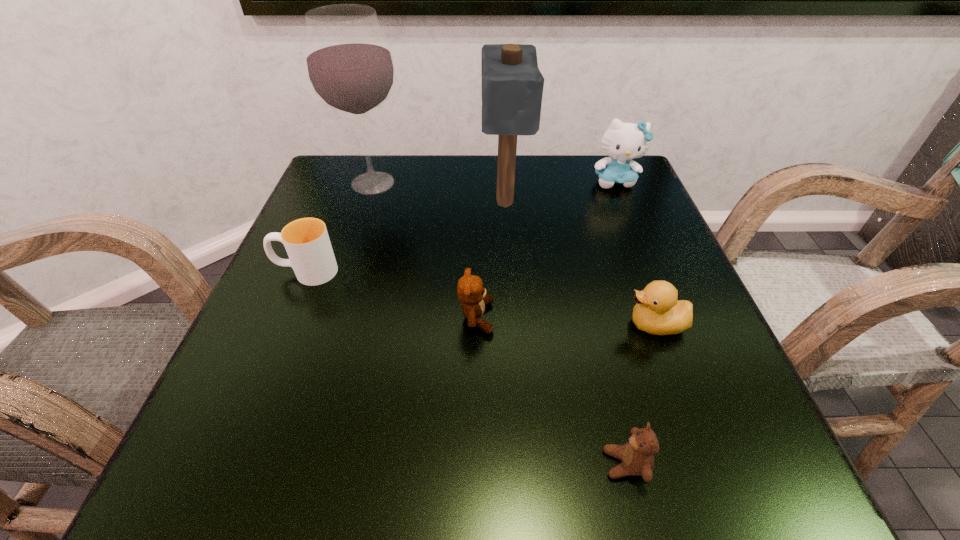
Where is `vacant position located on the face of the fifth shortest object`? The width and height of the screenshot is (960, 540). vacant position located on the face of the fifth shortest object is located at coordinates point(633,224).

You are a GUI agent. You are given a task and a screenshot of the screen. Output one action in this format:
    pyautogui.click(x=<x>, y=<y>)
    Task: Click on the vacant space situated on the front-facing side of the left teddy bear
    This screenshot has width=960, height=540.
    Given the screenshot: What is the action you would take?
    pyautogui.click(x=553, y=318)

Where is `vacant space located on the face of the duckling`? Image resolution: width=960 pixels, height=540 pixels. vacant space located on the face of the duckling is located at coordinates (594, 325).

Locate an element on the screen. The width and height of the screenshot is (960, 540). blank space located on the face of the duckling is located at coordinates [444, 325].

The image size is (960, 540). In order to click on vacant space located on the face of the duckling in this screenshot , I will do `click(450, 325)`.

Find the location of a particular element. The image size is (960, 540). vacant space located 0.380m at the face of the shorter teddy bear is located at coordinates (309, 464).

Where is `blank area located at the face of the shorter teddy bear`? blank area located at the face of the shorter teddy bear is located at coordinates pos(387,464).

Locate an element on the screen. Image resolution: width=960 pixels, height=540 pixels. free region located at the face of the shorter teddy bear is located at coordinates (395, 464).

Identify the location of alcohol located at the far edge. The width and height of the screenshot is (960, 540). (350, 67).

Locate an element on the screen. This screenshot has height=540, width=960. mallet that is at the far edge is located at coordinates (512, 85).